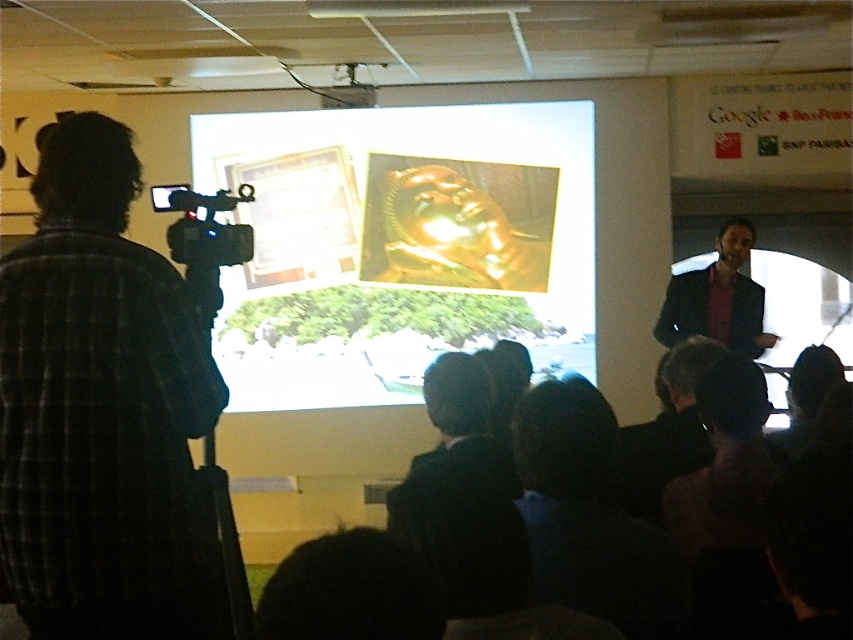
You are a photographer at the event and need to place a small tripod between the black fabric at lower center and the black plastic video camera at left. Which object should you place the tripod closer to if you want it to be near the larger object?

The black fabric at lower center is bigger than the black plastic video camera at left, so you should place the tripod closer to the black fabric at lower center.

You are a technician setting up a live stream for the presentation. You need to ensure that the black fabric at lower center and the black plastic video camera at left are both visible in the camera frame. Based on their sizes, which object might require adjustment to fit into the frame?

The black fabric at lower center is much taller than the black plastic video camera at left, so it might require adjustment to fit into the frame due to its greater height.

In the scene shown: You are a technician who needs to adjust the distance between the dark blue suit at right and the black plastic video camera at left to ensure proper recording. The current distance is 9.43 feet. If the recommended distance for optimal recording is between 8 to 10 feet, is the current setup within the recommended range?

The dark blue suit at right and the black plastic video camera at left are 9.43 feet apart, which falls within the recommended 8 to 10 feet range for optimal recording. Therefore, the current setup is acceptable.